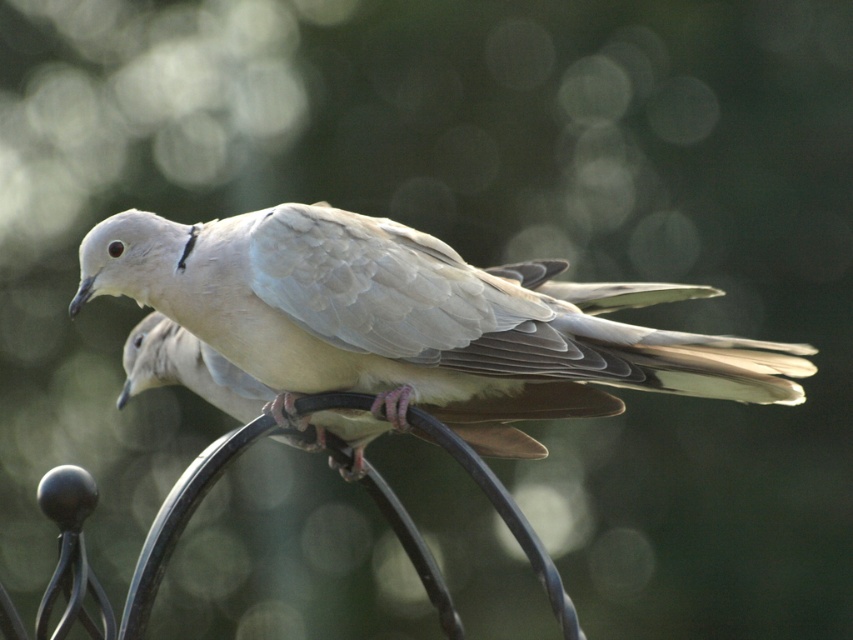
You are a photographer adjusting your camera focus. You have two points in the image that you need to focus on, point (431, 285) and point (241, 410). Which point should you focus on first if you want to ensure the closest object is sharp?

You should focus on point (431, 285) first because it is closer to the viewer than point (241, 410).

You are a birdwatcher observing two birds in a garden. You see a matte white dove at center and a light gray feathered bird at center. Which bird is positioned higher in the image?

The matte white dove at center is positioned higher than the light gray feathered bird at center.

Based on the photo, you are a photographer adjusting your camera focus. You want to capture both the matte white dove at center and the light gray feathered bird at center clearly. Since the background is out of focus, which dove should you focus on first to ensure the closest one is sharp?

The matte white dove at center is closer to the viewer than the light gray feathered bird at center, so you should focus on the matte white dove at center first to ensure it is sharp.